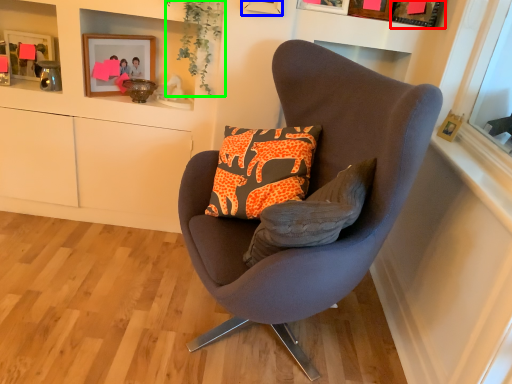
Question: Based on their relative distances, which object is farther from picture frame (highlighted by a red box)? Choose from picture frame (highlighted by a blue box) and plant (highlighted by a green box).

Choices:
 (A) picture frame
 (B) plant

Answer: (B)